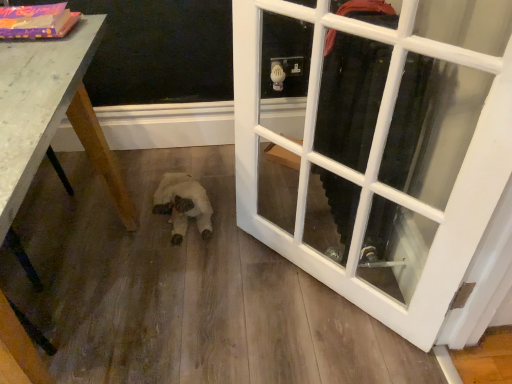
I want to click on free region under white plush toy at center (from a real-world perspective), so click(183, 212).